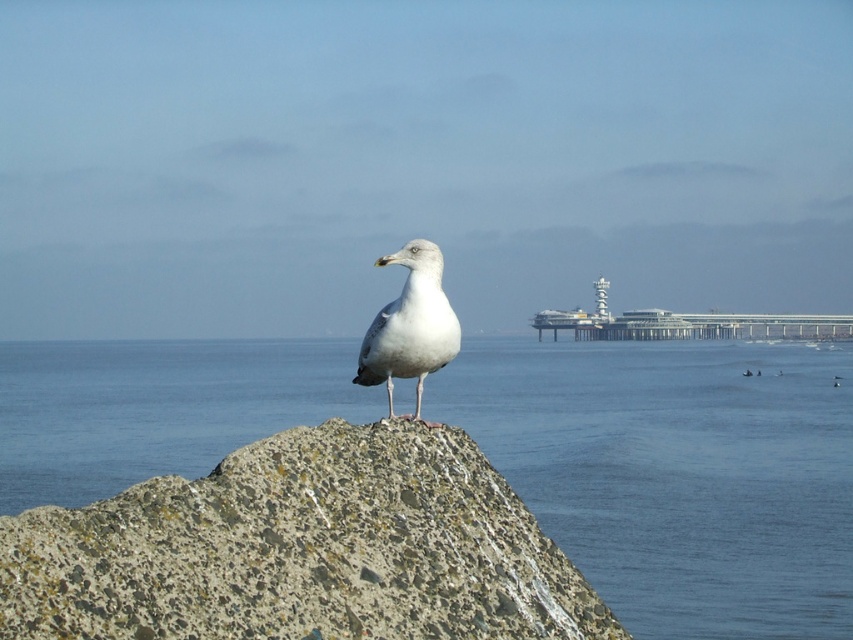
Who is lower down, blue water at center or white feathered bird at center?

blue water at center is lower down.

Which is behind, point (683, 570) or point (459, 337)?

The point (683, 570) is behind.

Who is more forward, (744,358) or (437,314)?

Point (437,314) is more forward.

This screenshot has width=853, height=640. In order to click on blue water at center in this screenshot , I will do `click(676, 472)`.